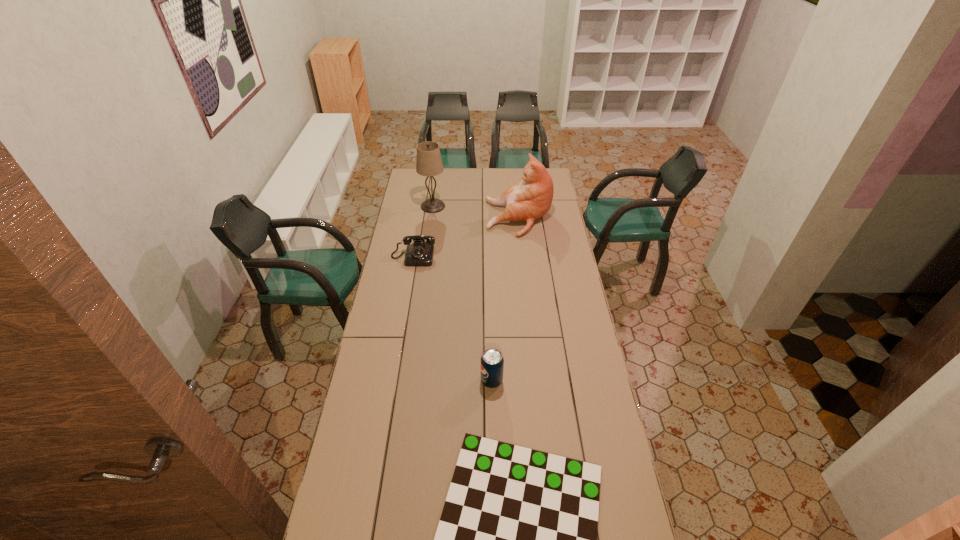
Image resolution: width=960 pixels, height=540 pixels. Find the location of `blank space located on the right of the fourth farthest object`. blank space located on the right of the fourth farthest object is located at coordinates (560, 381).

Where is `vacant space located 0.060m on the dial of the third farthest object`? The height and width of the screenshot is (540, 960). vacant space located 0.060m on the dial of the third farthest object is located at coordinates (410, 275).

Locate an element on the screen. The width and height of the screenshot is (960, 540). lampshade situated at the left edge is located at coordinates (429, 163).

This screenshot has height=540, width=960. Find the location of `telephone present at the left edge`. telephone present at the left edge is located at coordinates (420, 253).

Find the location of a particular element. This screenshot has height=540, width=960. object located at the right edge is located at coordinates (531, 198).

This screenshot has height=540, width=960. Identify the location of vacant space at the far edge of the desktop. (439, 180).

At what (x,y) coordinates should I click in order to perform the action: click on free spot at the left edge of the desktop. Please return your answer as a coordinate pair (x, y). Looking at the image, I should click on (424, 221).

Identify the location of vacant space at the right edge of the desktop. The height and width of the screenshot is (540, 960). (596, 418).

This screenshot has width=960, height=540. I want to click on free space between the lampshade and the soda can, so click(463, 293).

This screenshot has width=960, height=540. I want to click on free space between the lampshade and the cat, so click(476, 212).